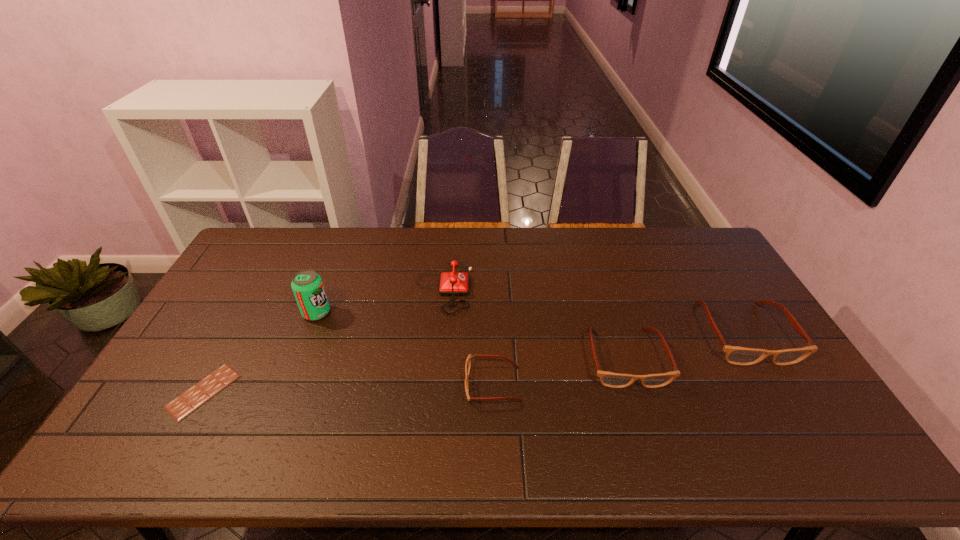
You are a GUI agent. You are given a task and a screenshot of the screen. Output one action in this format:
    pyautogui.click(x=<x>, y=<y>)
    Task: Click on the free space for a new spectacles on the left
    
    Given the screenshot: What is the action you would take?
    pyautogui.click(x=345, y=415)